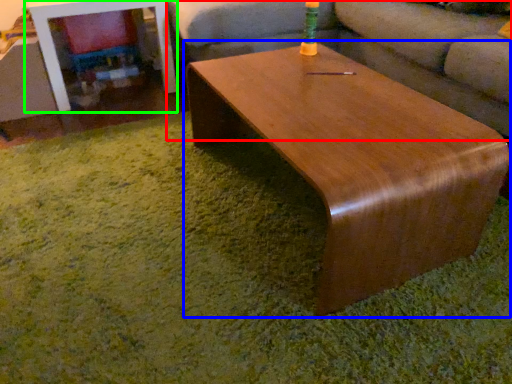
Question: Considering the real-world distances, which object is closest to studio couch (highlighted by a red box)? coffee table (highlighted by a blue box) or table (highlighted by a green box).

Choices:
 (A) coffee table
 (B) table

Answer: (A)